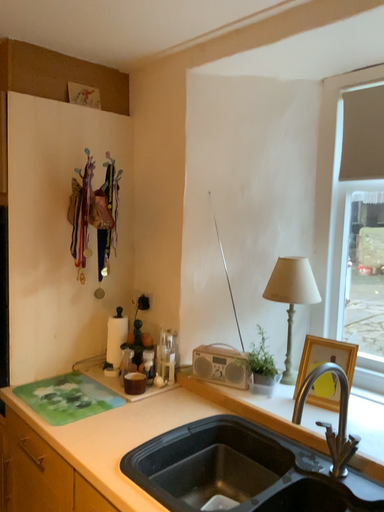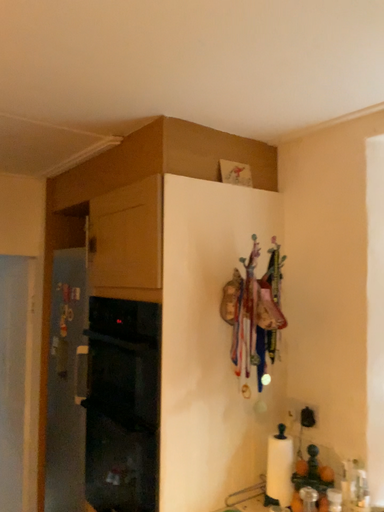
Question: Which way did the camera rotate in the video?

Choices:
 (A) rotated left
 (B) rotated right

Answer: (A)